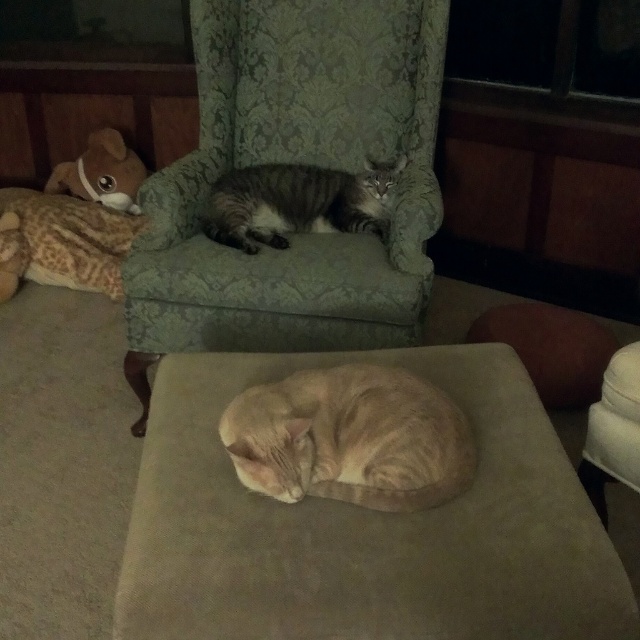
Question: Which of the following is the closest to the observer?

Choices:
 (A) (92, 180)
 (B) (227, 237)
 (C) (236, 448)
 (D) (310, 634)

Answer: (D)

Question: Which of the following is the closest to the observer?

Choices:
 (A) soft plush dog at left
 (B) orange tabby cat at lower center
 (C) beige fabric cat at center

Answer: (C)

Question: Does green damask armchair at upper center appear under soft plush dog at left?

Choices:
 (A) yes
 (B) no

Answer: (A)

Question: Does green damask armchair at upper center have a lesser width compared to soft plush dog at left?

Choices:
 (A) yes
 (B) no

Answer: (B)

Question: Which of these objects is positioned closest to the soft plush dog at left?

Choices:
 (A) beige fabric cat at center
 (B) green damask armchair at upper center
 (C) orange tabby cat at lower center
 (D) gray striped cat at center

Answer: (B)

Question: Is orange tabby cat at lower center further to camera compared to gray striped cat at center?

Choices:
 (A) yes
 (B) no

Answer: (B)